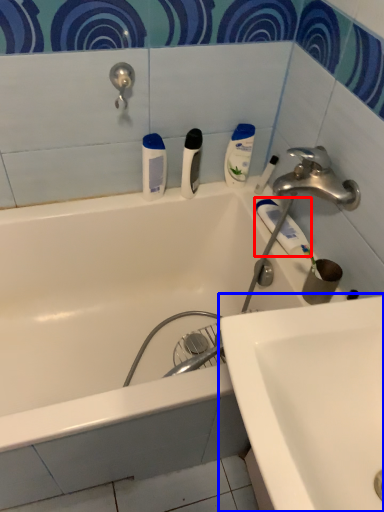
Question: Which of the following is the closest to the observer, toothpaste (highlighted by a red box) or sink (highlighted by a blue box)?

Choices:
 (A) toothpaste
 (B) sink

Answer: (B)